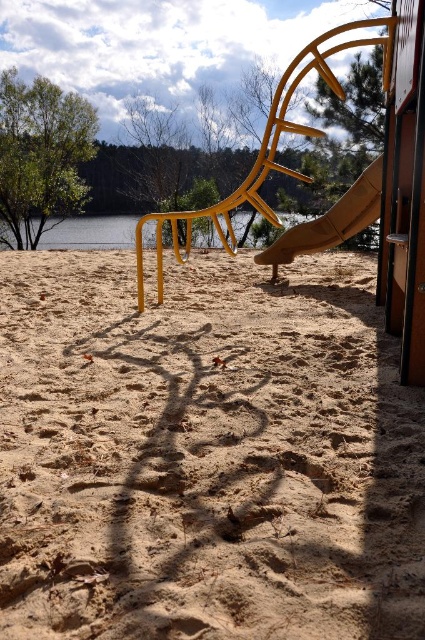
Between green leafy tree at left and transparent water at center, which one appears on the right side from the viewer's perspective?

From the viewer's perspective, transparent water at center appears more on the right side.

Which of these two, green leafy tree at left or transparent water at center, stands shorter?

With less height is green leafy tree at left.

What do you see at coordinates (40, 156) in the screenshot? I see `green leafy tree at left` at bounding box center [40, 156].

This screenshot has height=640, width=425. Find the location of `green leafy tree at left`. green leafy tree at left is located at coordinates (40, 156).

This screenshot has height=640, width=425. In order to click on brown sandy ground at center in this screenshot , I will do `click(204, 456)`.

Find the location of `brown sandy ground at center`. brown sandy ground at center is located at coordinates (204, 456).

Is green leafy tree at left above matte yellow slide at center?

Yes.

Is green leafy tree at left wider than matte yellow slide at center?

Yes.

Identify the location of green leafy tree at left. The image size is (425, 640). (40, 156).